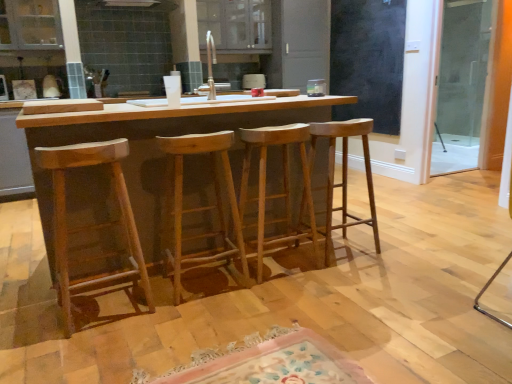
Question: Are natural wood table at center and white ceramic sink at center far apart?

Choices:
 (A) no
 (B) yes

Answer: (A)

Question: Considering the relative sizes of natural wood table at center and white ceramic sink at center in the image provided, is natural wood table at center thinner than white ceramic sink at center?

Choices:
 (A) no
 (B) yes

Answer: (A)

Question: Can you confirm if natural wood table at center is positioned to the right of white ceramic sink at center?

Choices:
 (A) yes
 (B) no

Answer: (B)

Question: Is natural wood table at center oriented towards white ceramic sink at center?

Choices:
 (A) no
 (B) yes

Answer: (A)

Question: Is white ceramic sink at center completely or partially inside natural wood table at center?

Choices:
 (A) no
 (B) yes

Answer: (A)

Question: Would you say natural wood stool at left, the 1th stool in the left-to-right sequence, is to the left or to the right of natural wood stool at center, the 1th stool viewed from the right, in the picture?

Choices:
 (A) right
 (B) left

Answer: (B)

Question: Based on their sizes in the image, would you say natural wood stool at left, the 1th stool in the left-to-right sequence, is bigger or smaller than natural wood stool at center, the 1th stool viewed from the right?

Choices:
 (A) small
 (B) big

Answer: (A)

Question: Is natural wood stool at left, the 1th stool in the left-to-right sequence, situated inside natural wood stool at center, placed as the fourth stool when sorted from left to right, or outside?

Choices:
 (A) inside
 (B) outside

Answer: (B)

Question: In the image, is natural wood stool at left, the 4th stool when ordered from right to left, positioned in front of or behind natural wood stool at center, placed as the fourth stool when sorted from left to right?

Choices:
 (A) front
 (B) behind

Answer: (A)

Question: Considering their positions, is floral rug at lower center located in front of or behind natural wood table at center?

Choices:
 (A) behind
 (B) front

Answer: (B)

Question: Is floral rug at lower center wider or thinner than natural wood table at center?

Choices:
 (A) wide
 (B) thin

Answer: (B)

Question: Looking at the image, does floral rug at lower center seem bigger or smaller compared to natural wood table at center?

Choices:
 (A) big
 (B) small

Answer: (B)

Question: Would you say floral rug at lower center is inside or outside natural wood table at center?

Choices:
 (A) inside
 (B) outside

Answer: (B)

Question: From the image's perspective, relative to black matte screen door at upper right, which is the first screen door from left to right, is natural wood stool at center, placed as the 2th stool when sorted from left to right, above or below?

Choices:
 (A) below
 (B) above

Answer: (A)

Question: From a real-world perspective, relative to black matte screen door at upper right, which is the first screen door from left to right, is natural wood stool at center, placed as the 2th stool when sorted from left to right, vertically above or below?

Choices:
 (A) above
 (B) below

Answer: (B)